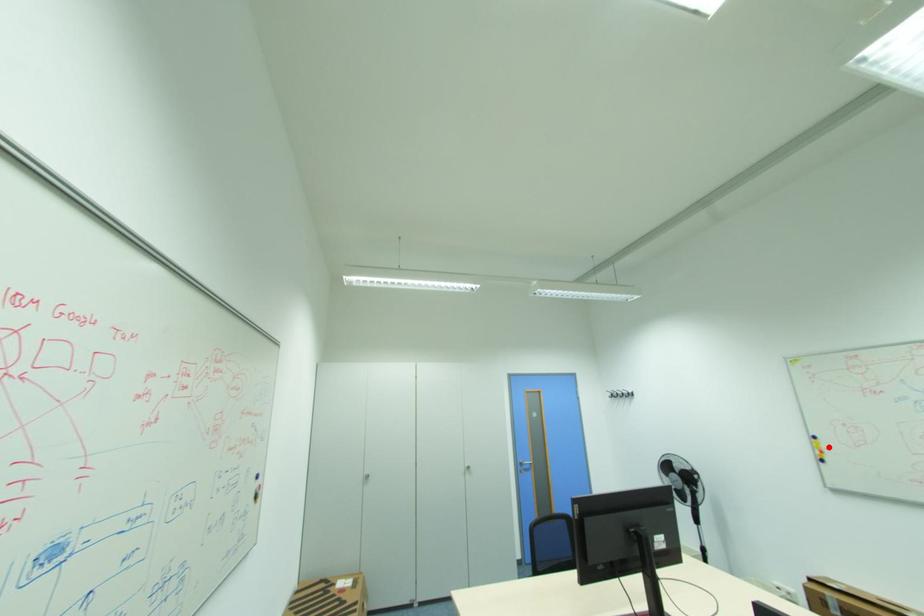
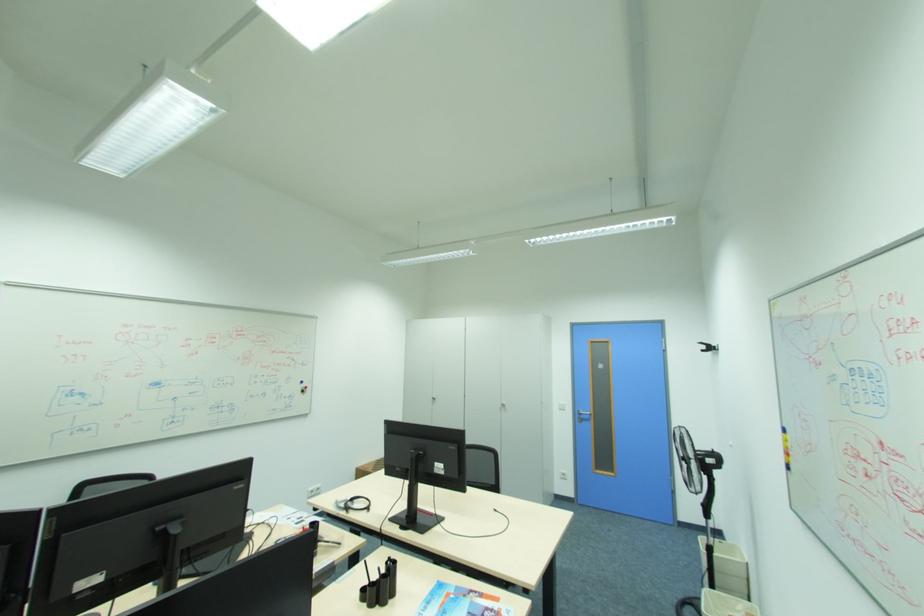
Question: A red point is marked in image1. In image2, is the corresponding 3D point closer to the camera or farther? Reply with the corresponding letter.

Choices:
 (A) The corresponding 3D point is closer.
 (B) The corresponding 3D point is farther.

Answer: (B)